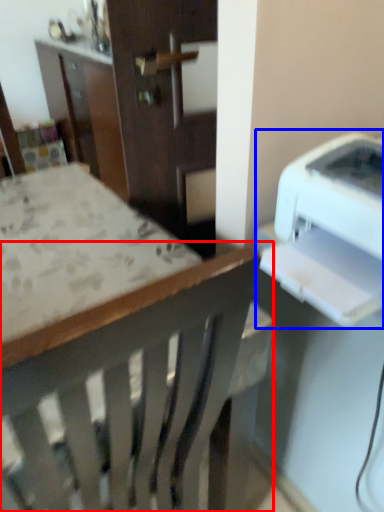
Question: Among these objects, which one is farthest to the camera, chair (highlighted by a red box) or printer (highlighted by a blue box)?

Choices:
 (A) chair
 (B) printer

Answer: (B)